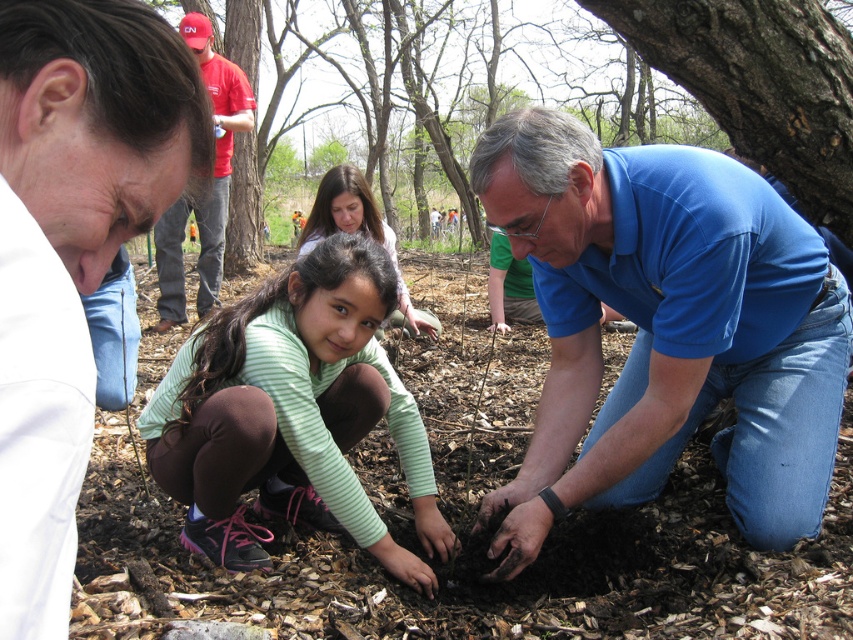
Where is the smooth bark tree at upper right located in the image?

The smooth bark tree at upper right is located at point (759,84) in the image.

You are a photographer trying to capture both the red cotton shirt at upper left and the light green striped shirt at center in a single frame. Which shirt should you focus on first to ensure both are in the frame?

The red cotton shirt at upper left is bigger than the light green striped striped shirt at center, so you should focus on the red cotton shirt at upper left first to ensure both are in the frame.